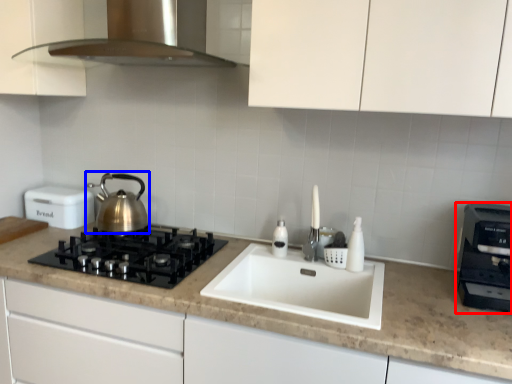
Question: Which point is closer to the camera, kitchen appliance (highlighted by a red box) or kettle (highlighted by a blue box)?

Choices:
 (A) kitchen appliance
 (B) kettle

Answer: (A)